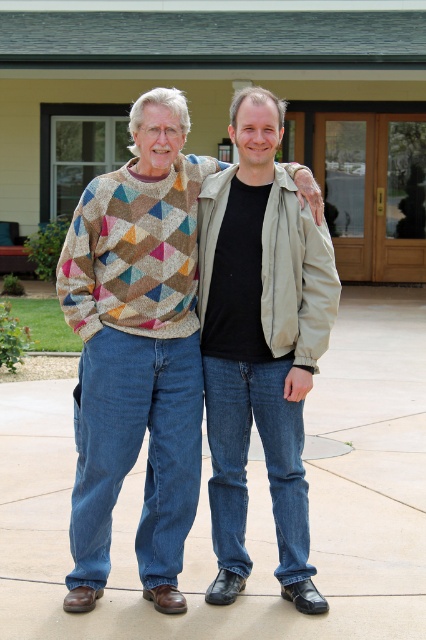
Which is more to the left, multicolored knitted sweater at center or matte beige jacket at center?

multicolored knitted sweater at center

Is multicolored knitted sweater at center positioned in front of matte beige jacket at center?

Yes, multicolored knitted sweater at center is closer to the viewer.

Which is behind, point (104, 429) or point (227, 259)?

The point (227, 259) is more distant.

This screenshot has height=640, width=426. In order to click on multicolored knitted sweater at center in this screenshot , I will do `click(137, 349)`.